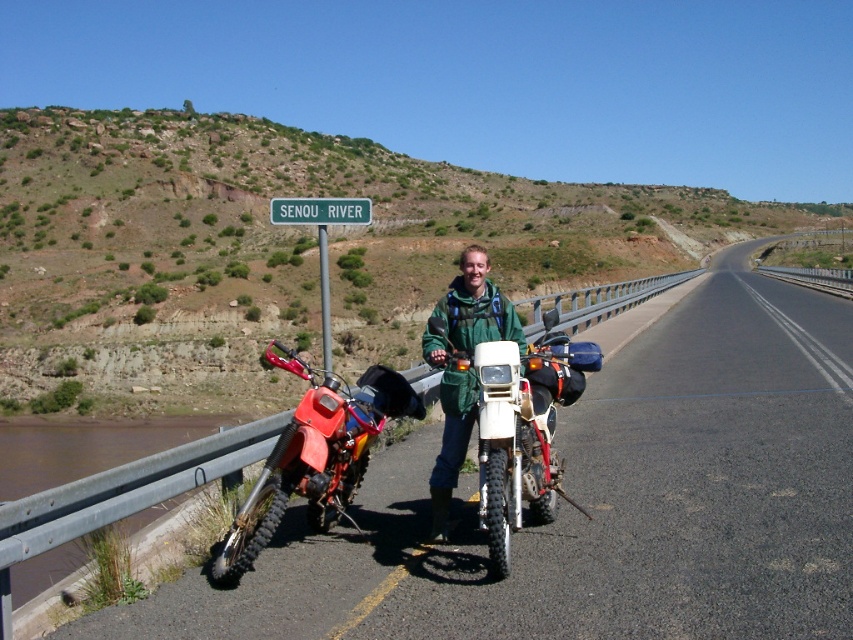
You are a photographer planning to take a photo of the orange matte dirt bike at left and the green plastic sign at upper center. You want both objects to be clearly visible in the same frame. Given that your camera has a maximum focal length that allows capturing objects up to 40 feet apart in the same shot, will you need to adjust your position or equipment?

The orange matte dirt bike at left and green plastic sign at upper center are 42.88 feet apart from each other. Since this exceeds the camera maximum focal length limit of 40 feet, you will need to adjust your position or equipment to capture both in the same frame.

You are a photographer trying to capture a photo of the green plastic sign at upper center without the green matte jacket at center blocking it. Based on their heights, can you suggest a way to position yourself to avoid the jacket?

The green matte jacket at center is taller than the green plastic sign at upper center. To avoid blocking the sign, position yourself lower so that the jacket appears below the sign in the frame.